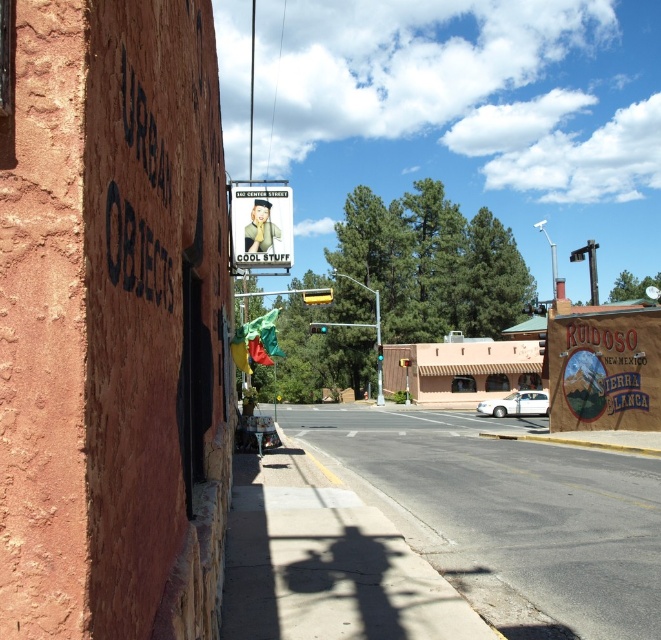
You are a tourist in Ruidoso, New Mexico, and you see the matte brown signboard at right and the matte plastic sign at upper center. Which one takes up more space in the image?

The matte plastic sign at upper center takes up more space in the image than the matte brown signboard at right because the matte brown signboard at right occupies less space than matte plastic sign at upper center.

You are a tourist in Ruidoso, New Mexico, and you see the matte brown signboard at right and the matte plastic sign at upper center. Which one is positioned more to the east side of the image?

The matte brown signboard at right is positioned more to the east side of the image because it is to the right of the matte plastic sign at upper center, and in the image, right corresponds to east.